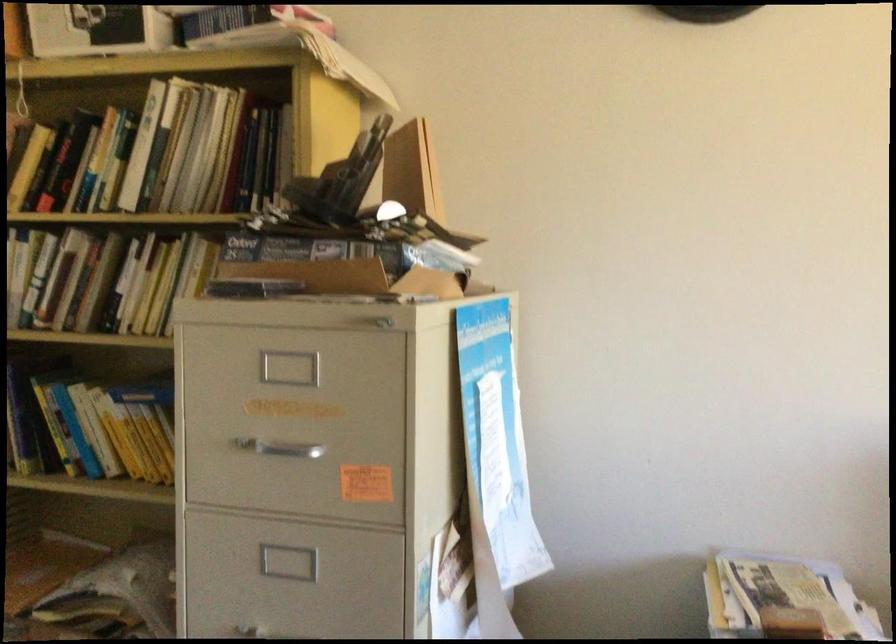
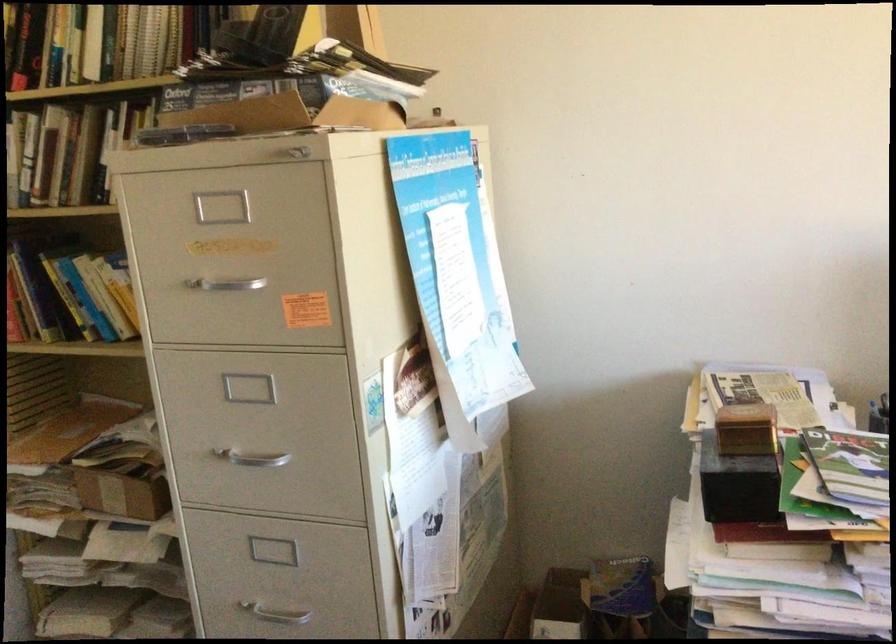
The point at (x=108, y=285) is marked in the first image. Where is the corresponding point in the second image?

(83, 156)